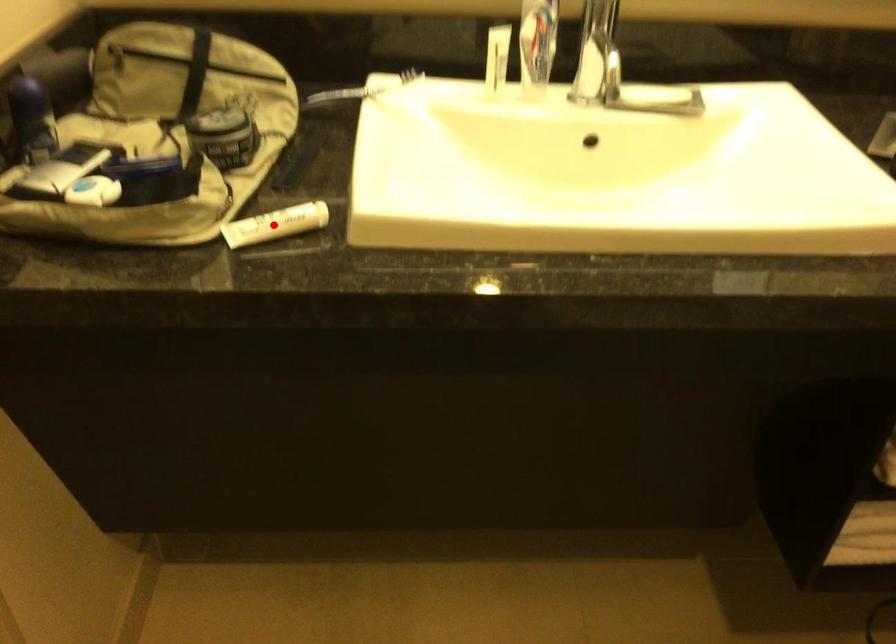
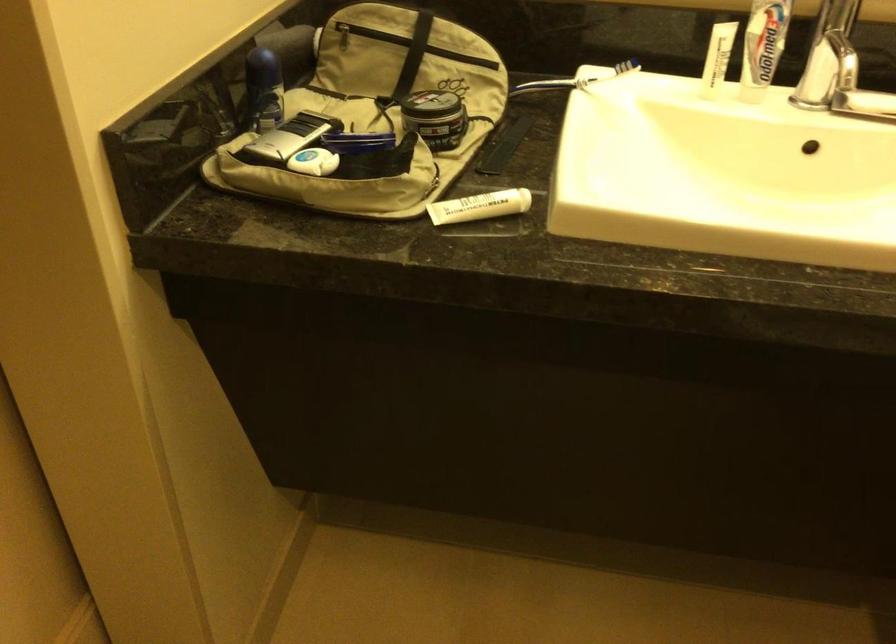
Locate, in the second image, the point that corresponds to the highlighted location in the first image.

(479, 205)